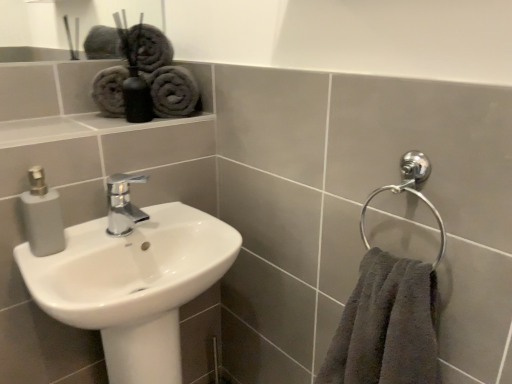
Question: Is gray cotton towels at upper left in front of or behind dark gray plush towel at right in the image?

Choices:
 (A) front
 (B) behind

Answer: (B)

Question: Would you say gray cotton towels at upper left is to the left or to the right of dark gray plush towel at right in the picture?

Choices:
 (A) right
 (B) left

Answer: (B)

Question: Which object is the farthest from the white glossy sink at lower left?

Choices:
 (A) dark gray plush towel at right
 (B) polished chrome faucet at center
 (C) gray cotton towels at upper left

Answer: (C)

Question: Which is farther from the gray cotton towels at upper left?

Choices:
 (A) dark gray plush towel at right
 (B) polished chrome faucet at center
 (C) white glossy sink at lower left

Answer: (A)